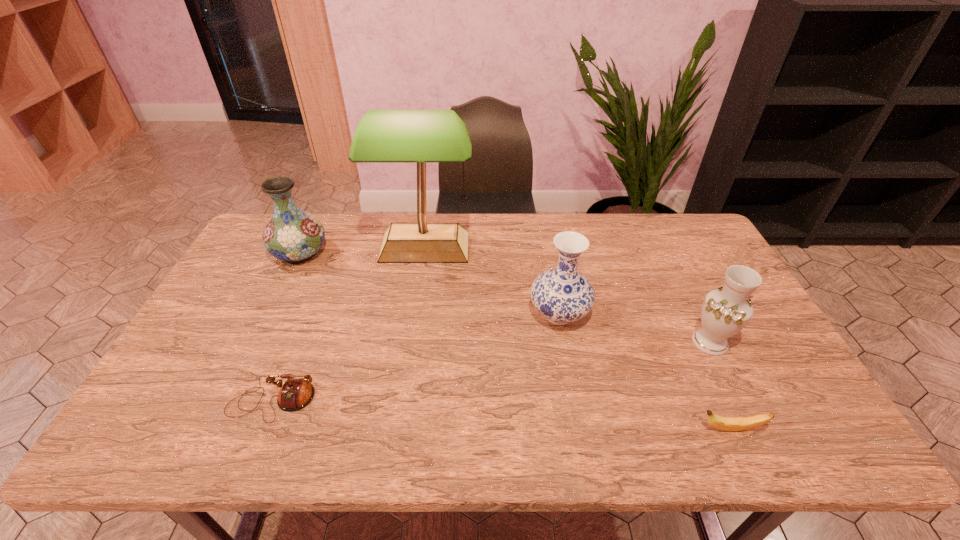
Identify the location of free point located on the back of the rightmost vase. (662, 246).

Where is `free space located at the stem of the banana`? This screenshot has height=540, width=960. free space located at the stem of the banana is located at coordinates (632, 429).

I want to click on blank space located 0.230m at the stem of the banana, so click(596, 429).

At what (x,y) coordinates should I click in order to perform the action: click on vacant space located 0.100m at the stem of the banana. Please return your answer as a coordinate pair (x, y). Looking at the image, I should click on (653, 429).

This screenshot has width=960, height=540. What are the coordinates of `table lamp positioned at the far edge` in the screenshot? It's located at (421, 136).

Locate an element on the screen. vase at the far edge is located at coordinates (293, 235).

Locate an element on the screen. This screenshot has height=540, width=960. telephone that is at the near edge is located at coordinates (295, 394).

Identify the location of banana present at the near edge. The image size is (960, 540). (722, 423).

I want to click on object that is at the left edge, so click(293, 235).

In order to click on vase that is at the right edge in this screenshot , I will do `click(725, 311)`.